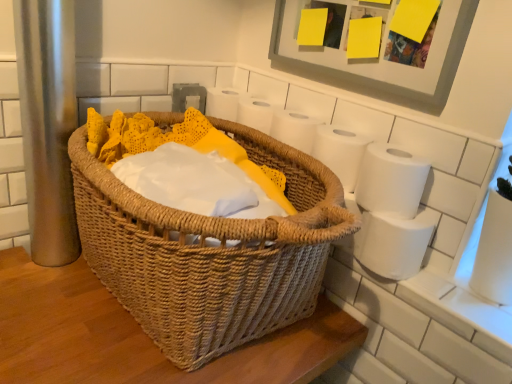
Question: Is woven brown picnic basket at center in front of white matte toilet paper at right, which is counted as the third toilet paper, starting from the top?

Choices:
 (A) yes
 (B) no

Answer: (A)

Question: Is woven brown picnic basket at center bigger than white matte toilet paper at right, placed as the first toilet paper when sorted from bottom to top?

Choices:
 (A) no
 (B) yes

Answer: (B)

Question: Is woven brown picnic basket at center facing away from white matte toilet paper at right, which is counted as the third toilet paper, starting from the top?

Choices:
 (A) yes
 (B) no

Answer: (A)

Question: Would you say woven brown picnic basket at center is a long distance from white matte toilet paper at right, which is counted as the third toilet paper, starting from the top?

Choices:
 (A) yes
 (B) no

Answer: (B)

Question: Is the depth of woven brown picnic basket at center greater than that of white matte toilet paper at right, which is counted as the third toilet paper, starting from the top?

Choices:
 (A) no
 (B) yes

Answer: (A)

Question: In the image, is white matte toilet paper at upper right, acting as the third toilet paper starting from the bottom, on the left side or the right side of white matte toilet paper at right, which is counted as the second toilet paper, starting from the bottom?

Choices:
 (A) right
 (B) left

Answer: (B)

Question: Considering the positions of white matte toilet paper at upper right, acting as the third toilet paper starting from the bottom, and white matte toilet paper at right, acting as the 2th toilet paper starting from the top, in the image, is white matte toilet paper at upper right, acting as the third toilet paper starting from the bottom, taller or shorter than white matte toilet paper at right, acting as the 2th toilet paper starting from the top,?

Choices:
 (A) tall
 (B) short

Answer: (A)

Question: Looking at their shapes, would you say white matte toilet paper at upper right, arranged as the first toilet paper when viewed from the top, is wider or thinner than white matte toilet paper at right, which is counted as the second toilet paper, starting from the bottom?

Choices:
 (A) thin
 (B) wide

Answer: (B)

Question: Considering the positions of white matte toilet paper at upper right, acting as the third toilet paper starting from the bottom, and white matte toilet paper at right, acting as the 2th toilet paper starting from the top, in the image, is white matte toilet paper at upper right, acting as the third toilet paper starting from the bottom, bigger or smaller than white matte toilet paper at right, acting as the 2th toilet paper starting from the top,?

Choices:
 (A) small
 (B) big

Answer: (B)

Question: In the image, is white matte toilet paper at right, acting as the 2th toilet paper starting from the top, positioned in front of or behind white matte toilet paper at right, placed as the first toilet paper when sorted from bottom to top?

Choices:
 (A) behind
 (B) front

Answer: (B)

Question: Looking at the image, does white matte toilet paper at right, which is counted as the second toilet paper, starting from the bottom, seem bigger or smaller compared to white matte toilet paper at right, which is counted as the third toilet paper, starting from the top?

Choices:
 (A) big
 (B) small

Answer: (B)

Question: From a real-world perspective, relative to white matte toilet paper at right, placed as the first toilet paper when sorted from bottom to top, is white matte toilet paper at right, which is counted as the second toilet paper, starting from the bottom, vertically above or below?

Choices:
 (A) above
 (B) below

Answer: (A)

Question: Considering the positions of point (411, 185) and point (417, 244), is point (411, 185) closer or farther from the camera than point (417, 244)?

Choices:
 (A) farther
 (B) closer

Answer: (B)

Question: Considering their positions, is woven brown picnic basket at center located in front of or behind matte gray picture frame at upper right?

Choices:
 (A) front
 (B) behind

Answer: (A)

Question: From a real-world perspective, relative to matte gray picture frame at upper right, is woven brown picnic basket at center vertically above or below?

Choices:
 (A) below
 (B) above

Answer: (A)